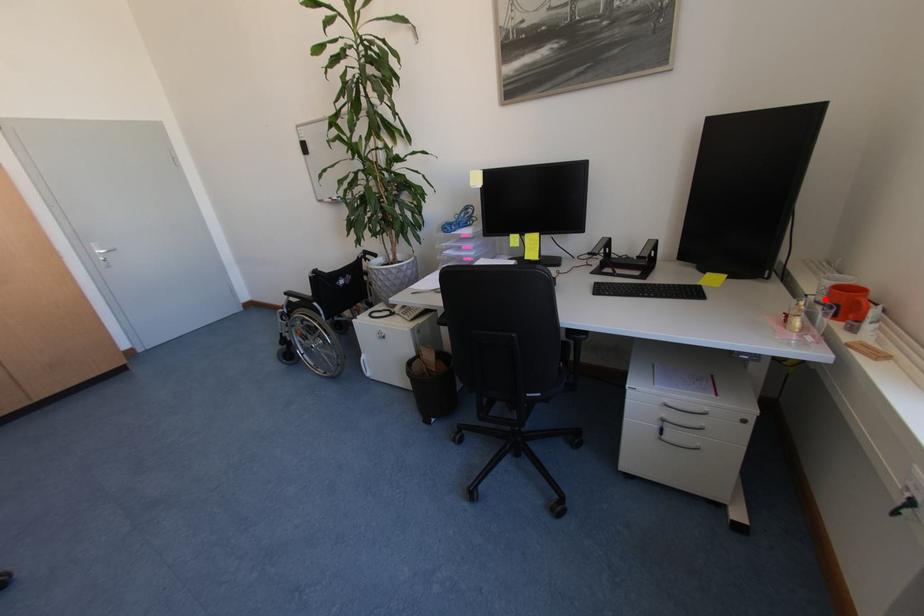
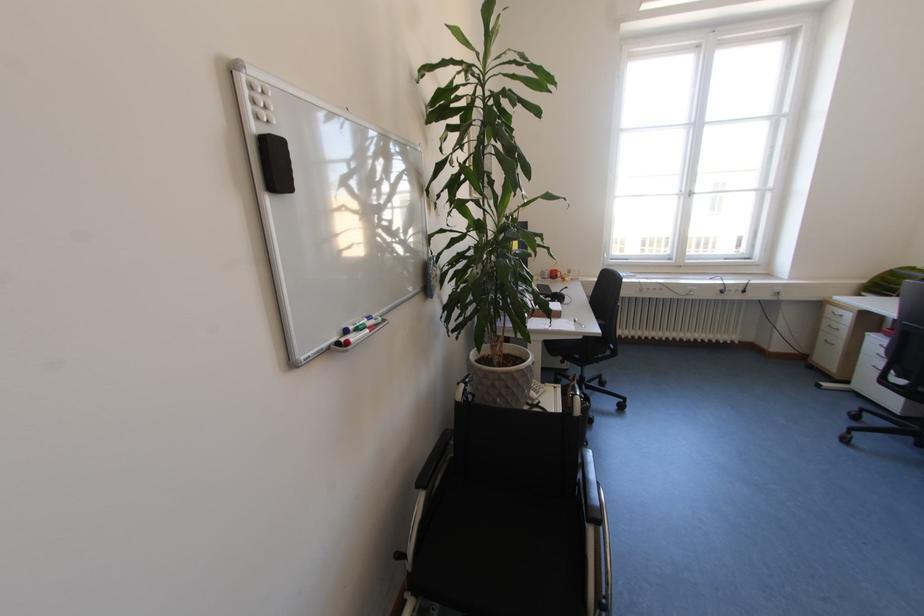
In the second image, find the point that corresponds to the highlighted location in the first image.

(553, 278)